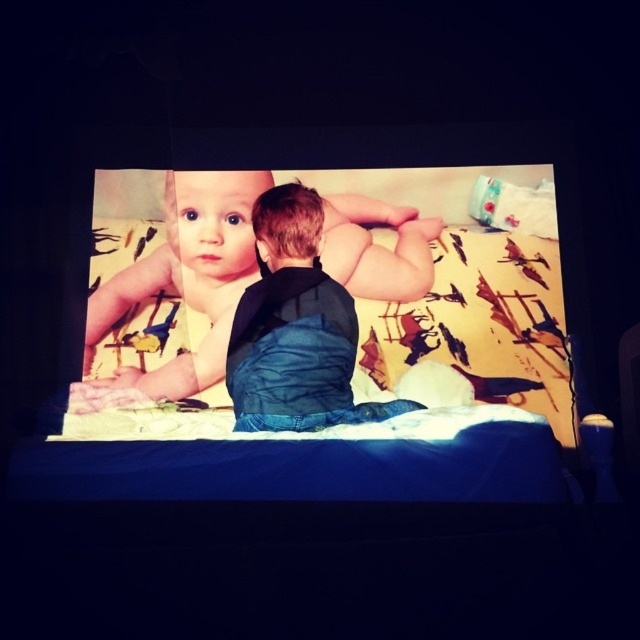
Question: Among these points, which one is farthest from the camera?

Choices:
 (A) (484, 211)
 (B) (339, 284)

Answer: (A)

Question: Is smooth skin baby at center positioned at the back of white fabric diaper at upper right?

Choices:
 (A) yes
 (B) no

Answer: (B)

Question: Can you confirm if yellow fabric bed at center is positioned below denim jacket at center?

Choices:
 (A) no
 (B) yes

Answer: (A)

Question: Can you confirm if yellow fabric bed at center is wider than smooth skin baby at center?

Choices:
 (A) yes
 (B) no

Answer: (A)

Question: Which of these objects is positioned farthest from the white fabric diaper at upper right?

Choices:
 (A) smooth skin baby at center
 (B) denim jacket at center

Answer: (A)

Question: Which object appears farthest from the camera in this image?

Choices:
 (A) smooth skin baby at center
 (B) white fabric diaper at upper right
 (C) denim jacket at center
 (D) yellow fabric bed at center

Answer: (B)